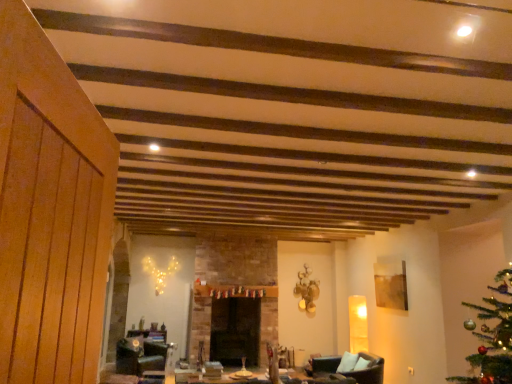
Question: Is brown leather armchair at lower right not close to black leather swivel chair at lower center?

Choices:
 (A) yes
 (B) no

Answer: (A)

Question: Is brown leather armchair at lower right in contact with black leather swivel chair at lower center?

Choices:
 (A) no
 (B) yes

Answer: (A)

Question: Is the position of brown leather armchair at lower right less distant than that of black leather swivel chair at lower center?

Choices:
 (A) yes
 (B) no

Answer: (A)

Question: Is brown leather armchair at lower right thinner than black leather swivel chair at lower center?

Choices:
 (A) no
 (B) yes

Answer: (A)

Question: Is the depth of brown leather armchair at lower right greater than that of black leather swivel chair at lower center?

Choices:
 (A) no
 (B) yes

Answer: (A)

Question: From a real-world perspective, is brown leather armchair at lower right under black leather swivel chair at lower center?

Choices:
 (A) yes
 (B) no

Answer: (B)

Question: Is black leather swivel chair at lower center positioned in front of brown leather armchair at lower right?

Choices:
 (A) no
 (B) yes

Answer: (A)

Question: Is there a large distance between black leather swivel chair at lower center and brown leather armchair at lower right?

Choices:
 (A) yes
 (B) no

Answer: (A)

Question: Does black leather swivel chair at lower center have a smaller size compared to brown leather armchair at lower right?

Choices:
 (A) no
 (B) yes

Answer: (B)

Question: Is brown leather armchair at lower right a part of black leather swivel chair at lower center?

Choices:
 (A) yes
 (B) no

Answer: (B)

Question: Is black leather swivel chair at lower center not inside brown leather armchair at lower right?

Choices:
 (A) yes
 (B) no

Answer: (A)

Question: From the image's perspective, would you say black leather swivel chair at lower center is shown under brown leather armchair at lower right?

Choices:
 (A) no
 (B) yes

Answer: (B)

Question: Is black stone fireplace at center facing away from black leather swivel chair at lower center?

Choices:
 (A) no
 (B) yes

Answer: (A)